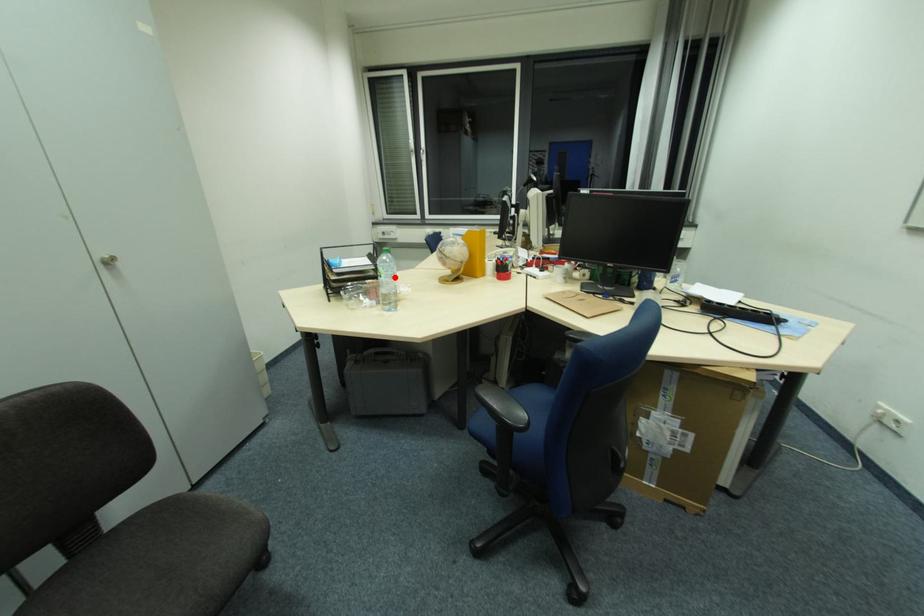
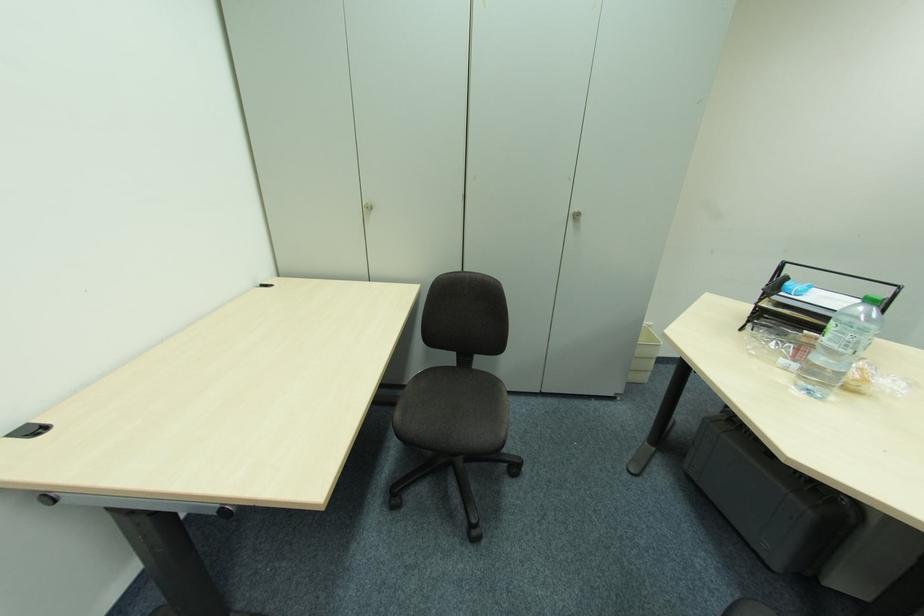
Question: I am providing you with two images of the same scene from different viewpoints. A red point is marked on the first image. Is the red point's position out of view in image 2?

Choices:
 (A) Yes
 (B) No

Answer: (B)